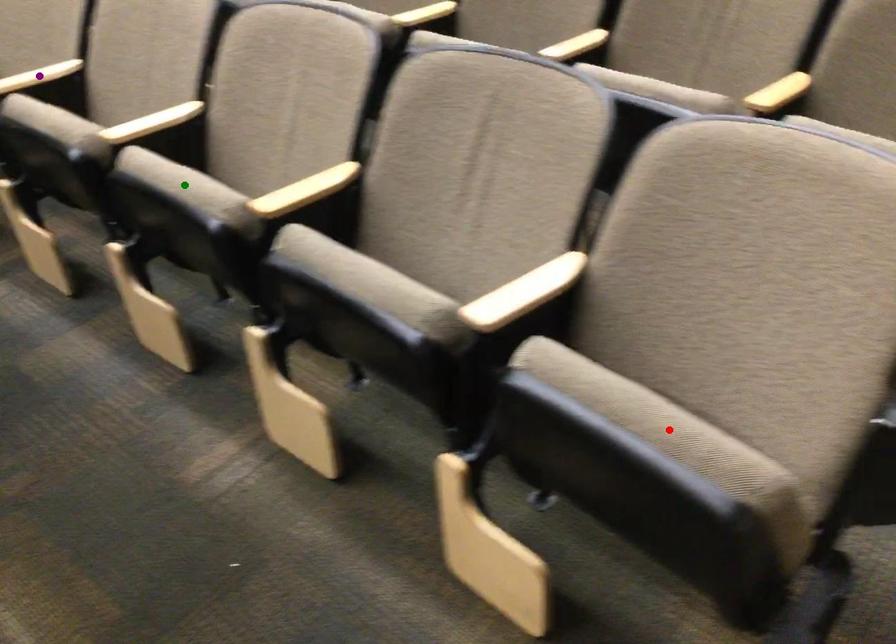
Order these from nearest to farthest:
green point, purple point, red point

red point
green point
purple point